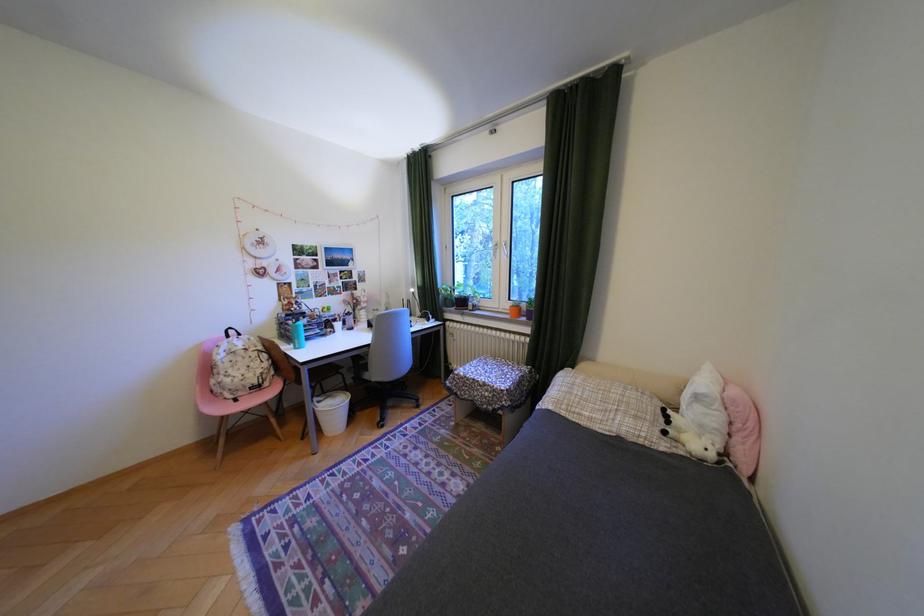
Where would you sit the pink chair sitting surface? Please return your answer as a coordinate pair (x, y).

(246, 397)